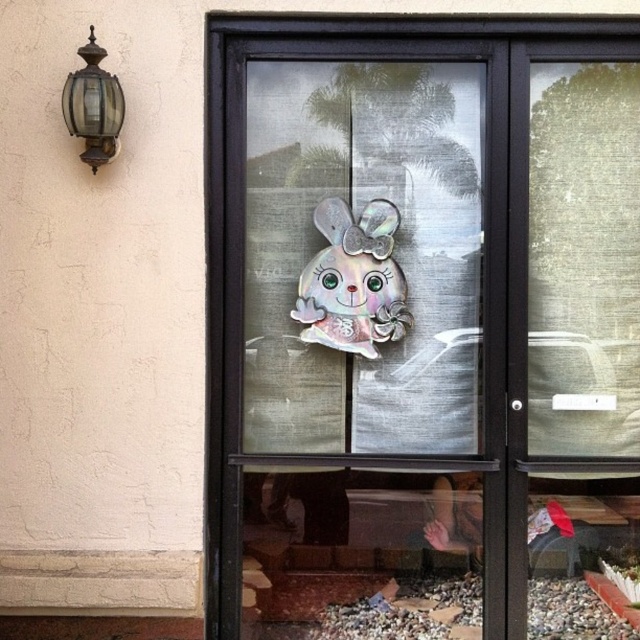
Can you confirm if holographic sticker at center is shorter than bronze glass lantern at upper left?

No.

Describe the element at coordinates (420, 317) in the screenshot. I see `holographic sticker at center` at that location.

Image resolution: width=640 pixels, height=640 pixels. Find the location of `holographic sticker at center`. holographic sticker at center is located at coordinates (420, 317).

Can you confirm if holographic sticker at center is positioned above holographic bunny at center?

Actually, holographic sticker at center is below holographic bunny at center.

What do you see at coordinates (420, 317) in the screenshot? The image size is (640, 640). I see `holographic sticker at center` at bounding box center [420, 317].

Who is more distant from viewer, (525, 378) or (392, 308)?

Positioned behind is point (392, 308).

What are the coordinates of `holographic sticker at center` in the screenshot? It's located at 420,317.

Is point (378, 218) positioned behind point (83, 113)?

Yes.

Between holographic bunny at center and bronze glass lantern at upper left, which one appears on the left side from the viewer's perspective?

bronze glass lantern at upper left is more to the left.

Find the location of a particular element. Image resolution: width=640 pixels, height=640 pixels. holographic bunny at center is located at coordinates (353, 280).

Locate an element on the screen. holographic bunny at center is located at coordinates (353, 280).